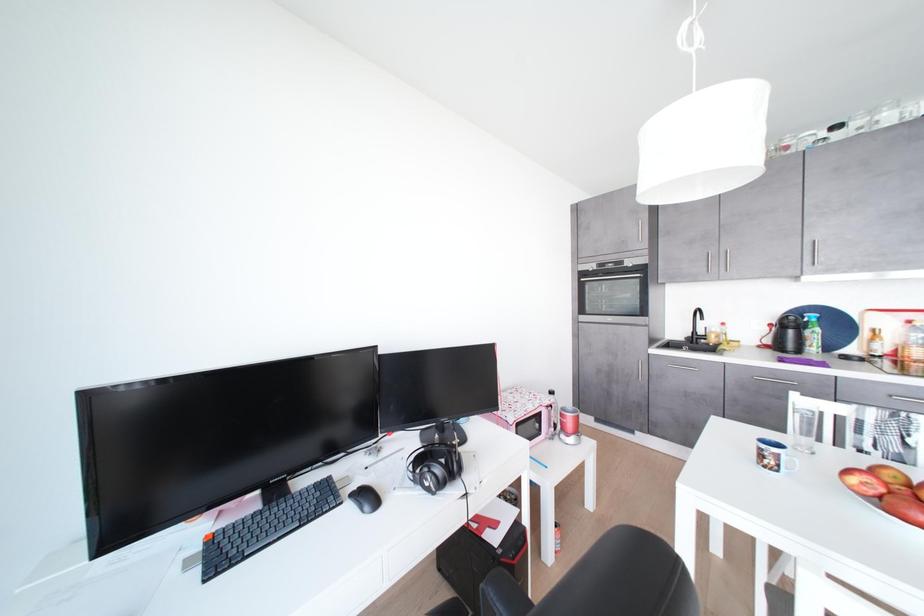
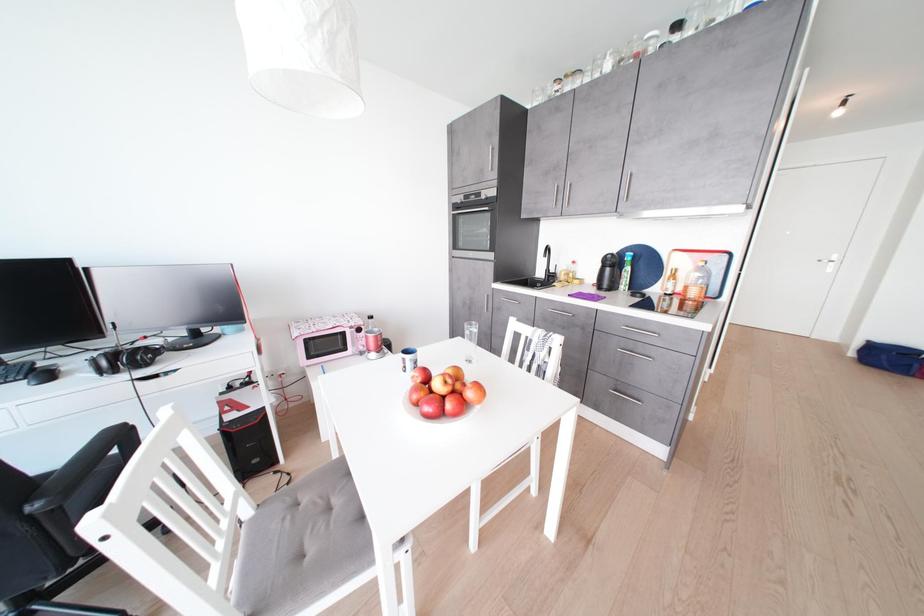
Question: Which direction would the cameraman need to move to produce the second image? Reply with the corresponding letter.

Choices:
 (A) Left
 (B) Right
 (C) Forward
 (D) Backward

Answer: (B)